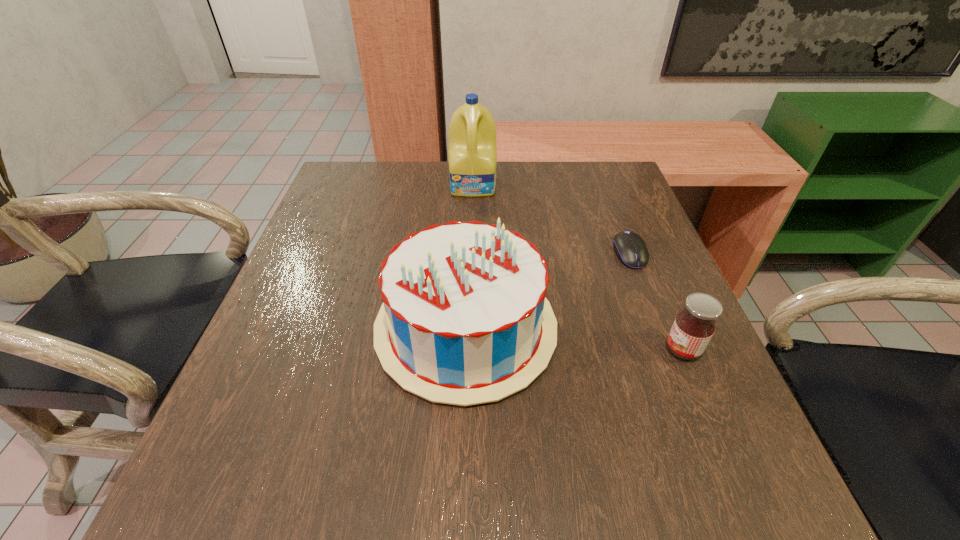
You are a GUI agent. You are given a task and a screenshot of the screen. Output one action in this format:
    pyautogui.click(x=<x>, y=<y>)
    Task: Click on the free space that satisfies the following two spatial constraints: 1. on the back side of the shortest object; 2. on the left side of the birthday cake
    
    Given the screenshot: What is the action you would take?
    pyautogui.click(x=468, y=254)